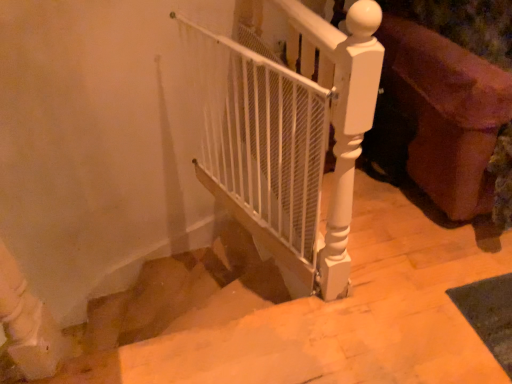
Question: Is smooth beige stairs at center further to the viewer compared to white mesh gate at center?

Choices:
 (A) yes
 (B) no

Answer: (B)

Question: Is smooth beige stairs at center facing away from white mesh gate at center?

Choices:
 (A) no
 (B) yes

Answer: (A)

Question: Does smooth beige stairs at center have a greater height compared to white mesh gate at center?

Choices:
 (A) yes
 (B) no

Answer: (B)

Question: Is smooth beige stairs at center located outside white mesh gate at center?

Choices:
 (A) yes
 (B) no

Answer: (A)

Question: Is smooth beige stairs at center at the left side of white mesh gate at center?

Choices:
 (A) yes
 (B) no

Answer: (B)

Question: From the image's perspective, is smooth beige stairs at center under white mesh gate at center?

Choices:
 (A) no
 (B) yes

Answer: (B)

Question: Does white mesh gate at center have a lesser width compared to velvet purple sofa at right?

Choices:
 (A) yes
 (B) no

Answer: (A)

Question: From a real-world perspective, is white mesh gate at center positioned under velvet purple sofa at right based on gravity?

Choices:
 (A) yes
 (B) no

Answer: (A)

Question: Does white mesh gate at center have a greater width compared to velvet purple sofa at right?

Choices:
 (A) no
 (B) yes

Answer: (A)

Question: Is white mesh gate at center to the right of velvet purple sofa at right from the viewer's perspective?

Choices:
 (A) no
 (B) yes

Answer: (A)

Question: Is white mesh gate at center oriented away from velvet purple sofa at right?

Choices:
 (A) yes
 (B) no

Answer: (A)

Question: From a real-world perspective, is white mesh gate at center positioned over velvet purple sofa at right based on gravity?

Choices:
 (A) no
 (B) yes

Answer: (A)

Question: Are white mesh gate at center and smooth beige stairs at center located far from each other?

Choices:
 (A) no
 (B) yes

Answer: (A)